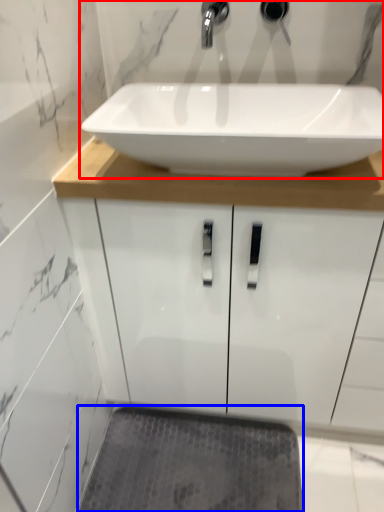
Question: Among these objects, which one is farthest to the camera, sink (highlighted by a red box) or bath mat (highlighted by a blue box)?

Choices:
 (A) sink
 (B) bath mat

Answer: (B)